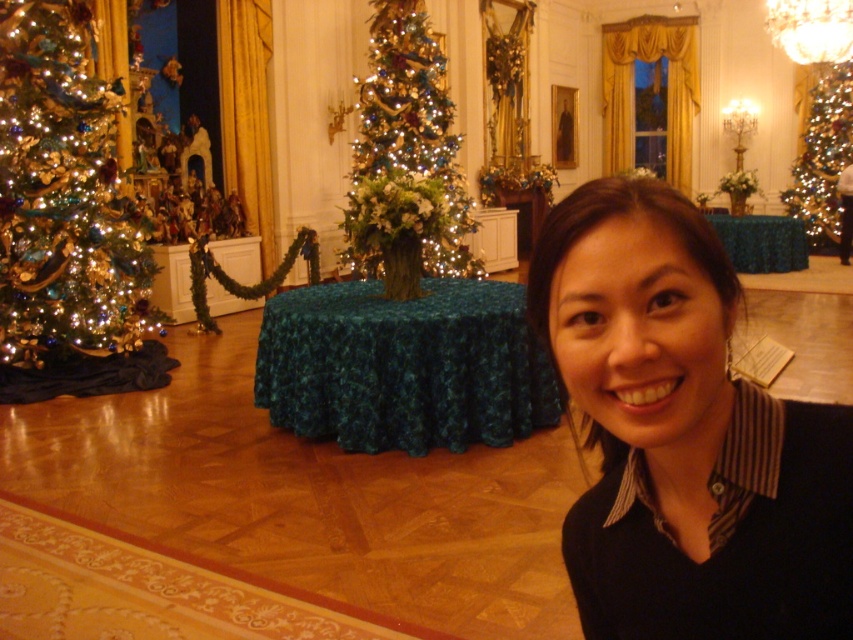
Question: Does shiny gold ornaments at left come in front of iridescent glass christmas tree at center?

Choices:
 (A) no
 (B) yes

Answer: (B)

Question: Which point appears farthest from the camera in this image?

Choices:
 (A) (537, 282)
 (B) (65, 67)
 (C) (477, 259)

Answer: (C)

Question: Does iridescent glass christmas tree at center appear over shiny gold christmas tree at upper right?

Choices:
 (A) yes
 (B) no

Answer: (B)

Question: Is black striped shirt at center smaller than shiny gold ornaments at left?

Choices:
 (A) yes
 (B) no

Answer: (A)

Question: Which object is closer to the camera taking this photo?

Choices:
 (A) black striped shirt at center
 (B) shiny gold christmas tree at upper right

Answer: (A)

Question: Which object appears farthest from the camera in this image?

Choices:
 (A) iridescent glass christmas tree at center
 (B) black striped shirt at center
 (C) shiny gold ornaments at left

Answer: (A)